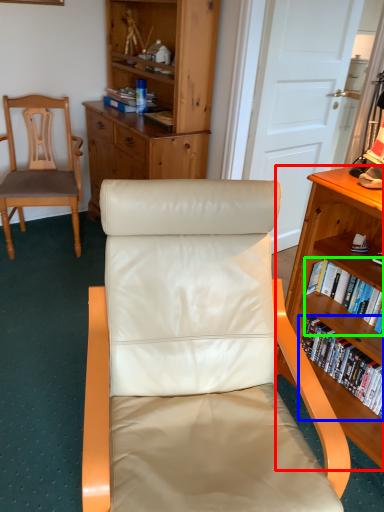
Question: Considering the real-world distances, which object is closest to shelf (highlighted by a red box)? book (highlighted by a blue box) or book (highlighted by a green box).

Choices:
 (A) book
 (B) book

Answer: (B)